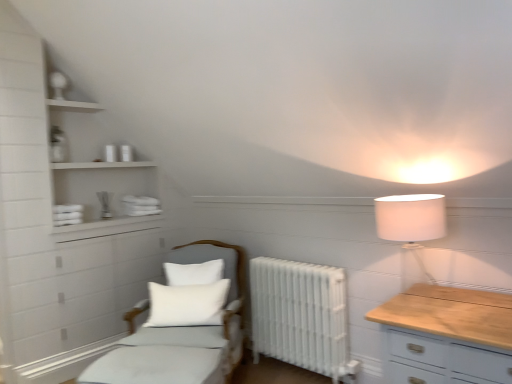
Question: Considering the positions of white fabric bed at lower left and white matte shelves at upper left in the image, is white fabric bed at lower left wider or thinner than white matte shelves at upper left?

Choices:
 (A) thin
 (B) wide

Answer: (B)

Question: Relative to white matte shelves at upper left, is white fabric bed at lower left in front or behind?

Choices:
 (A) behind
 (B) front

Answer: (B)

Question: Considering the real-world distances, which object is farthest from the light gray fabric chair at center?

Choices:
 (A) white fabric bed at lower left
 (B) white metallic radiator at center
 (C) white soft cushion at center
 (D) white fabric lampshade at upper right
 (E) white matte shelves at upper left

Answer: (D)

Question: Which object is the closest to the white fabric bed at lower left?

Choices:
 (A) white matte shelves at upper left
 (B) white soft cushion at center
 (C) light gray fabric chair at center
 (D) white fabric lampshade at upper right
 (E) white metallic radiator at center

Answer: (C)